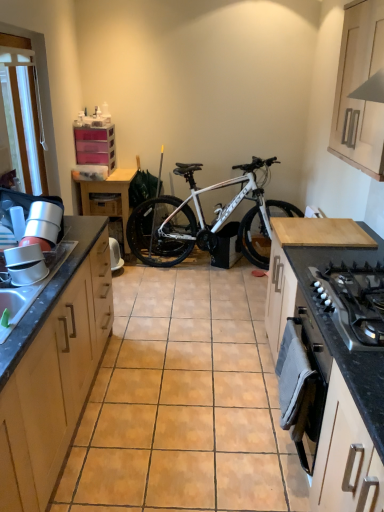
Question: From a real-world perspective, does white glossy cabinet at lower right, which appears as the second cabinetry when viewed from the right, sit lower than wooden drawer at center?

Choices:
 (A) no
 (B) yes

Answer: (B)

Question: Is wooden drawer at center inside white glossy cabinet at lower right, which appears as the second cabinetry when viewed from the right?

Choices:
 (A) yes
 (B) no

Answer: (B)

Question: Is white glossy cabinet at lower right, which is the 3th cabinetry from left to right, touching wooden drawer at center?

Choices:
 (A) yes
 (B) no

Answer: (B)

Question: Is white glossy cabinet at lower right, which is the 1th cabinetry in front-to-back order, closer to the viewer compared to wooden drawer at center?

Choices:
 (A) yes
 (B) no

Answer: (A)

Question: From the image's perspective, is white glossy cabinet at lower right, which is the 3th cabinetry from left to right, over wooden drawer at center?

Choices:
 (A) yes
 (B) no

Answer: (B)

Question: In terms of height, does wooden table at left look taller or shorter compared to transparent plastic drawers at upper left, which is the 4th cabinetry in right-to-left order?

Choices:
 (A) tall
 (B) short

Answer: (A)

Question: Is wooden table at left inside the boundaries of transparent plastic drawers at upper left, the 4th cabinetry viewed from the front, or outside?

Choices:
 (A) outside
 (B) inside

Answer: (A)

Question: Considering the positions of point (115, 178) and point (79, 147), is point (115, 178) closer or farther from the camera than point (79, 147)?

Choices:
 (A) farther
 (B) closer

Answer: (A)

Question: Would you say wooden table at left is to the left or to the right of transparent plastic drawers at upper left, the first cabinetry positioned from the left, in the picture?

Choices:
 (A) left
 (B) right

Answer: (B)

Question: From their relative heights in the image, would you say silver metallic gas stove at lower right is taller or shorter than white glossy sink at left?

Choices:
 (A) tall
 (B) short

Answer: (B)

Question: Based on their sizes in the image, would you say silver metallic gas stove at lower right is bigger or smaller than white glossy sink at left?

Choices:
 (A) big
 (B) small

Answer: (B)

Question: Considering their positions, is silver metallic gas stove at lower right located in front of or behind white glossy sink at left?

Choices:
 (A) front
 (B) behind

Answer: (A)

Question: From a real-world perspective, relative to white glossy sink at left, is silver metallic gas stove at lower right vertically above or below?

Choices:
 (A) below
 (B) above

Answer: (B)

Question: Which is correct: silver metallic gas stove at lower right is inside wooden cabinet at left, placed as the third cabinetry when sorted from back to front, or outside of it?

Choices:
 (A) outside
 (B) inside

Answer: (A)

Question: In the image, is silver metallic gas stove at lower right on the left side or the right side of wooden cabinet at left, the 3th cabinetry viewed from the right?

Choices:
 (A) right
 (B) left

Answer: (A)